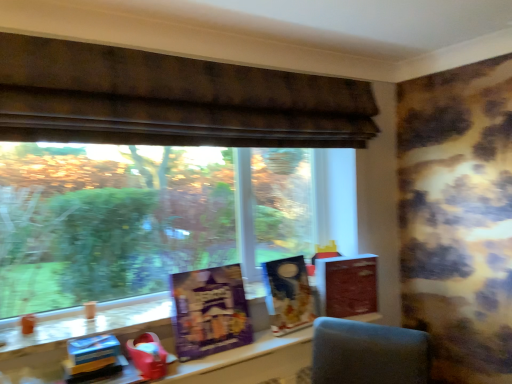
What is the approximate height of purple matte board game at center, acting as the first paperback book starting from the front?

purple matte board game at center, acting as the first paperback book starting from the front, is 17.22 inches in height.

You are a GUI agent. You are given a task and a screenshot of the screen. Output one action in this format:
    pyautogui.click(x=<x>, y=<y>)
    Task: Click on the matte brown book at right, marked as the 2th paperback book in a left-to-right arrangement
    The height and width of the screenshot is (384, 512).
    Given the screenshot: What is the action you would take?
    347,285

What is the approximate height of brown textured fabric at upper center?

It is 15.74 inches.

Find the location of a particular element. brown textured fabric at upper center is located at coordinates (170, 100).

You are a GUI agent. You are given a task and a screenshot of the screen. Output one action in this format:
    pyautogui.click(x=<x>, y=<y>)
    Task: Click on the shiny red toy at lower left, arranged as the 1th toy when viewed from the right
    Image resolution: width=512 pixels, height=384 pixels.
    Given the screenshot: What is the action you would take?
    pyautogui.click(x=148, y=356)

Identify the location of matte black book at center. (288, 295).

Could you tell me if brown textured fabric at upper center is facing matte black book at center?

No, brown textured fabric at upper center is not facing towards matte black book at center.

At what (x,y) coordinates should I click in order to perform the action: click on book cover below the brown textured fabric at upper center (from the image's perspective). Please return your answer as a coordinate pair (x, y). The image size is (512, 384). Looking at the image, I should click on (288, 295).

Between brown textured fabric at upper center and matte black book at center, which one is positioned in front?

brown textured fabric at upper center.

Which object is wider, blue cardboard box at lower left, which ranks as the 2th toy in right-to-left order, or brown textured fabric at upper center?

brown textured fabric at upper center is wider.

This screenshot has height=384, width=512. What are the coordinates of `the 1st toy behind when counting from the brown textured fabric at upper center` in the screenshot? It's located at (92, 358).

Looking at this image, which is in front, blue cardboard box at lower left, which ranks as the 2th toy in right-to-left order, or brown textured fabric at upper center?

brown textured fabric at upper center.

Which is closer, [71,368] or [88,55]?

Point [71,368] is closer to the camera than point [88,55].

From the image's perspective, is blue cardboard box at lower left, placed as the 1th toy when sorted from left to right, beneath matte black book at center?

Yes, from the image's perspective, blue cardboard box at lower left, placed as the 1th toy when sorted from left to right, is beneath matte black book at center.

Is blue cardboard box at lower left, which ranks as the 2th toy in right-to-left order, placed right next to matte black book at center?

No, blue cardboard box at lower left, which ranks as the 2th toy in right-to-left order, is not next to matte black book at center.

Is blue cardboard box at lower left, which ranks as the 2th toy in right-to-left order, looking in the opposite direction of matte black book at center?

No, blue cardboard box at lower left, which ranks as the 2th toy in right-to-left order,'s orientation is not away from matte black book at center.

From a real-world perspective, is matte black book at center on top of blue cardboard box at lower left, which ranks as the 2th toy in right-to-left order?

Yes.

Between matte black book at center and blue cardboard box at lower left, placed as the 1th toy when sorted from left to right, which one has larger width?

Wider between the two is blue cardboard box at lower left, placed as the 1th toy when sorted from left to right.

Is matte black book at center beside blue cardboard box at lower left, placed as the 1th toy when sorted from left to right?

No, matte black book at center is not touching blue cardboard box at lower left, placed as the 1th toy when sorted from left to right.

Is matte black book at center facing away from blue cardboard box at lower left, placed as the 1th toy when sorted from left to right?

No, matte black book at center's orientation is not away from blue cardboard box at lower left, placed as the 1th toy when sorted from left to right.

Is matte black book at center not close to matte brown book at right, the first paperback book viewed from the right?

No, matte black book at center is in close proximity to matte brown book at right, the first paperback book viewed from the right.

The image size is (512, 384). What are the coordinates of `paperback book behind the matte black book at center` in the screenshot? It's located at (347, 285).

Which object is positioned more to the left, matte black book at center or matte brown book at right, the first paperback book viewed from the right?

From the viewer's perspective, matte black book at center appears more on the left side.

How different are the orientations of brown textured fabric at upper center and matte plastic table at center in degrees?

The angular difference between brown textured fabric at upper center and matte plastic table at center is 0.207 degrees.

Is brown textured fabric at upper center wider or thinner than matte plastic table at center?

Considering their sizes, brown textured fabric at upper center looks broader than matte plastic table at center.

Would you say brown textured fabric at upper center is a long distance from matte plastic table at center?

Yes, brown textured fabric at upper center and matte plastic table at center are located far from each other.

Looking at this image, from a real-world perspective, is brown textured fabric at upper center physically above matte plastic table at center?

Correct, in the physical world, brown textured fabric at upper center is higher than matte plastic table at center.

Which is behind, matte black book at center or shiny red toy at lower left, arranged as the 2th toy when viewed from the left?

matte black book at center is behind.

Which point is more distant from viewer, (274, 319) or (136, 356)?

The point (274, 319) is farther from the camera.

Find the location of a particular element. toy that is the 1st one when counting forward from the matte black book at center is located at coordinates click(x=148, y=356).

Can you confirm if matte black book at center is shorter than shiny red toy at lower left, arranged as the 2th toy when viewed from the left?

No, matte black book at center is not shorter than shiny red toy at lower left, arranged as the 2th toy when viewed from the left.

Where is `window that appears above the matte black book at center (from the image's perspective)`? Image resolution: width=512 pixels, height=384 pixels. window that appears above the matte black book at center (from the image's perspective) is located at coordinates (170, 100).

Locate an element on the screen. window on the right of blue cardboard box at lower left, which ranks as the 2th toy in right-to-left order is located at coordinates (170, 100).

Based on the photo, estimate the real-world distances between objects in this image. Which object is further from matte plastic table at center, blue cardboard box at lower left, which ranks as the 2th toy in right-to-left order, or matte brown book at right, the second paperback book from the front?

matte brown book at right, the second paperback book from the front, is further to matte plastic table at center.

Which object lies further to the anchor point purple matte board game at center, acting as the first paperback book starting from the front, matte black book at center or matte plastic table at center?

matte black book at center.

When comparing their distances from purple matte board game at center, positioned as the second paperback book in right-to-left order, does matte black book at center or brown textured fabric at upper center seem closer?

matte black book at center is positioned closer to the anchor purple matte board game at center, positioned as the second paperback book in right-to-left order.

Considering their positions, is matte plastic table at center positioned closer to purple matte board game at center, which ranks as the second paperback book in back-to-front order, than matte black book at center?

matte plastic table at center is positioned closer to the anchor purple matte board game at center, which ranks as the second paperback book in back-to-front order.

Which object lies further to the anchor point brown textured fabric at upper center, blue cardboard box at lower left, which ranks as the 2th toy in right-to-left order, or matte brown book at right, the 1th paperback book from the back?

Among the two, blue cardboard box at lower left, which ranks as the 2th toy in right-to-left order, is located further to brown textured fabric at upper center.

From the image, which object appears to be nearer to purple matte board game at center, which ranks as the second paperback book in back-to-front order, shiny red toy at lower left, arranged as the 1th toy when viewed from the right, or brown textured fabric at upper center?

shiny red toy at lower left, arranged as the 1th toy when viewed from the right, lies closer to purple matte board game at center, which ranks as the second paperback book in back-to-front order, than the other object.

From the image, which object appears to be nearer to matte black book at center, matte brown book at right, the first paperback book viewed from the right, or shiny red toy at lower left, arranged as the 2th toy when viewed from the left?

The object closer to matte black book at center is matte brown book at right, the first paperback book viewed from the right.

Based on their spatial positions, is matte plastic table at center or matte brown book at right, the second paperback book from the front, closer to blue cardboard box at lower left, placed as the 1th toy when sorted from left to right?

The object closer to blue cardboard box at lower left, placed as the 1th toy when sorted from left to right, is matte plastic table at center.

Where is `paperback book between blue cardboard box at lower left, placed as the 1th toy when sorted from left to right, and matte brown book at right, the second paperback book from the front`? The width and height of the screenshot is (512, 384). paperback book between blue cardboard box at lower left, placed as the 1th toy when sorted from left to right, and matte brown book at right, the second paperback book from the front is located at coordinates (209, 311).

Where is `table between blue cardboard box at lower left, which ranks as the 2th toy in right-to-left order, and matte brown book at right, the first paperback book viewed from the right`? table between blue cardboard box at lower left, which ranks as the 2th toy in right-to-left order, and matte brown book at right, the first paperback book viewed from the right is located at coordinates (250, 362).

Image resolution: width=512 pixels, height=384 pixels. I want to click on toy between blue cardboard box at lower left, placed as the 1th toy when sorted from left to right, and matte brown book at right, marked as the 2th paperback book in a left-to-right arrangement, in the horizontal direction, so click(148, 356).

Locate an element on the screen. The image size is (512, 384). table situated between blue cardboard box at lower left, which ranks as the 2th toy in right-to-left order, and matte black book at center from left to right is located at coordinates (250, 362).